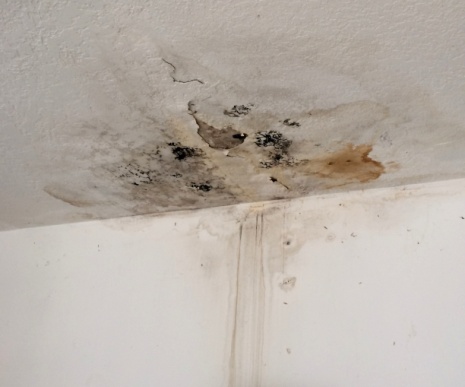
This screenshot has height=387, width=465. I want to click on crinkle in ceiling, so click(81, 57), click(39, 33), click(60, 31), click(48, 6), click(17, 54), click(32, 48), click(21, 62), click(383, 18), click(413, 21).